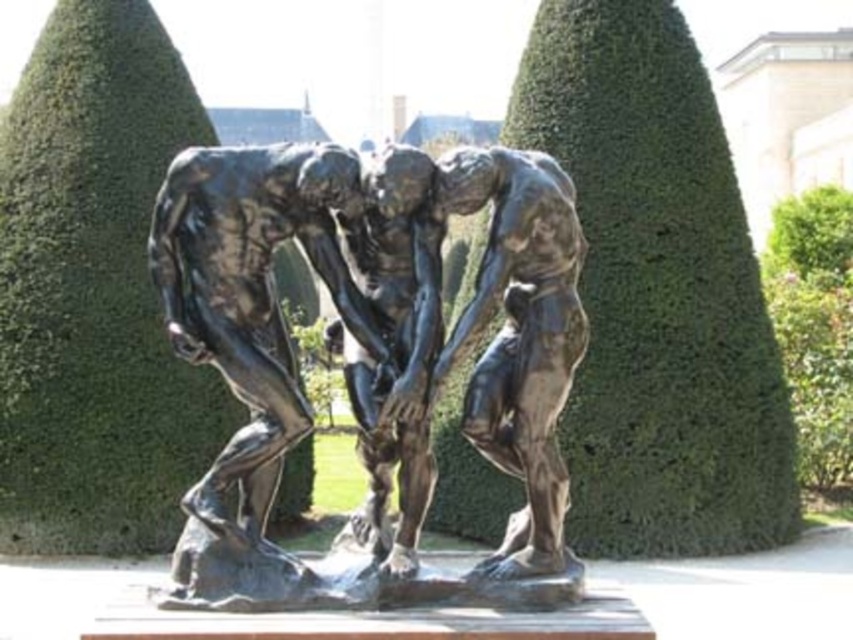
You are standing in front of the bronze sculpture with three figures. There are two points marked on the base of the sculpture. The first point is at coordinates point [743,388] and the second point is at point [790,260]. If you want to place a small plaque between them, which point should the plaque be closer to so it doesn???t block the view of the second point from your position?

The plaque should be placed closer to point [743,388] because it is in front of point [790,260]. This way, placing the plaque near the front point won???t obstruct the view of the rear point.

You are a landscape architect designing a garden pathway that needs to pass between the bronze sculpture at center and the green leafy hedge at center. Based on their positions, can you determine if the pathway should be placed above or below the hedge?

The bronze sculpture at center is below the green leafy hedge at center, so the pathway should be placed above the hedge to avoid blocking the view of the sculpture.

You are a landscape architect designing a garden layout. You need to place a new statue that requires a space larger than the green leafy hedge at center. Can the area where the green leafy bush at upper right is located accommodate this statue?

The green leafy hedge at center is smaller than the green leafy bush at upper right. Since the statue requires a space larger than the green leafy hedge at center, the area where the green leafy bush at upper right is located can accommodate the statue because it is larger.